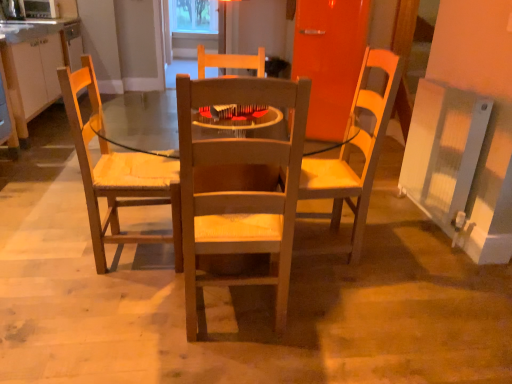
Question: Visually, is wooden chair at center positioned to the left or to the right of wooden chair at left?

Choices:
 (A) right
 (B) left

Answer: (A)

Question: Considering the positions of wooden chair at center and wooden chair at left in the image, is wooden chair at center taller or shorter than wooden chair at left?

Choices:
 (A) tall
 (B) short

Answer: (B)

Question: Estimate the real-world distances between objects in this image. Which object is closer to the wooden chair at center?

Choices:
 (A) matte white cabinets at left
 (B) metallic silver microwave oven at upper left
 (C) transparent plastic window screen at upper center
 (D) wooden chair at left

Answer: (D)

Question: Considering the real-world distances, which object is closest to the matte white cabinets at left?

Choices:
 (A) transparent plastic window screen at upper center
 (B) wooden chair at center
 (C) wooden chair at left
 (D) metallic silver microwave oven at upper left

Answer: (D)